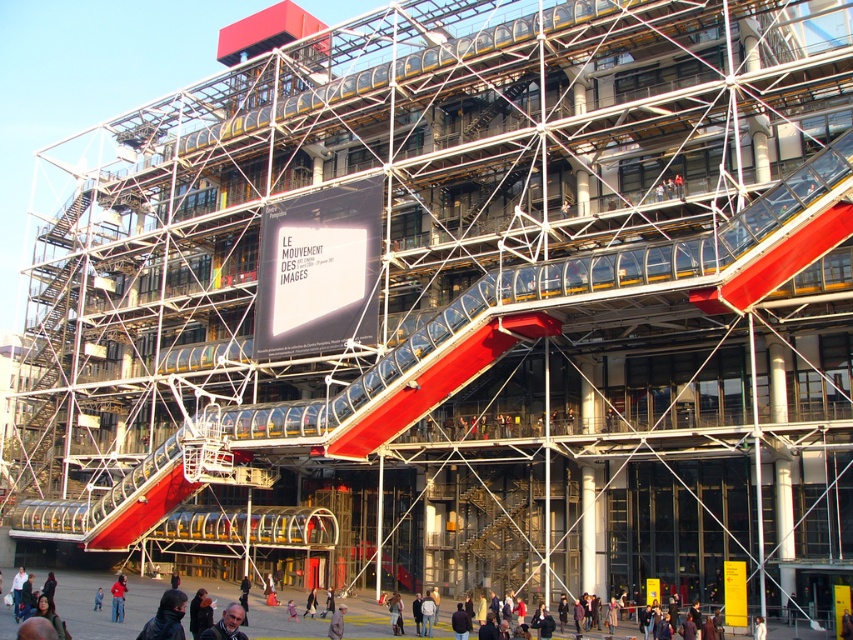
Question: From the image, what is the correct spatial relationship of red fabric jacket at lower left in relation to light brown leather jacket at center?

Choices:
 (A) left
 (B) right

Answer: (A)

Question: Is the position of light gray fabric jacket at center more distant than that of blue denim jacket at center?

Choices:
 (A) yes
 (B) no

Answer: (A)

Question: Does red fabric jacket at lower left have a larger size compared to blue denim jacket at center?

Choices:
 (A) no
 (B) yes

Answer: (B)

Question: Among these objects, which one is nearest to the camera?

Choices:
 (A) blue denim jacket at center
 (B) dark blue jacket at lower center
 (C) dark blue jacket at lower left

Answer: (B)

Question: Among these objects, which one is nearest to the camera?

Choices:
 (A) light gray fabric jacket at center
 (B) blue denim jacket at center

Answer: (B)

Question: Which of the following is the closest to the observer?

Choices:
 (A) (114, 604)
 (B) (218, 634)

Answer: (B)